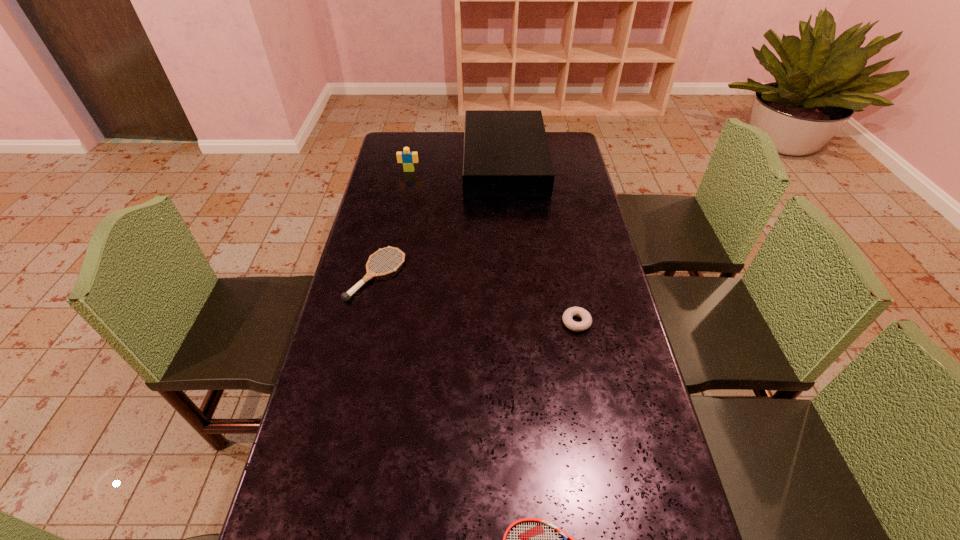
Find the location of a particular element. The image size is (960, 540). vacant space located on the left of the doughnut is located at coordinates (488, 322).

Locate an element on the screen. The width and height of the screenshot is (960, 540). object at the far edge is located at coordinates (506, 154).

At what (x,y) coordinates should I click in order to perform the action: click on Lego at the left edge. Please return your answer as a coordinate pair (x, y). Looking at the image, I should click on (408, 158).

This screenshot has height=540, width=960. Find the location of `tennis racket positioned at the left edge`. tennis racket positioned at the left edge is located at coordinates pos(346,296).

You are a GUI agent. You are given a task and a screenshot of the screen. Output one action in this format:
    pyautogui.click(x=<x>, y=<y>)
    Task: Click on the CD player at the right edge
    
    Given the screenshot: What is the action you would take?
    pyautogui.click(x=506, y=154)

Where is `doughnut located at the right edge`? doughnut located at the right edge is located at coordinates (586, 322).

Where is `object that is at the far right corner`? The image size is (960, 540). object that is at the far right corner is located at coordinates (506, 154).

Where is `vacant space at the far edge of the desktop`? The image size is (960, 540). vacant space at the far edge of the desktop is located at coordinates (448, 142).

What are the coordinates of `blank space at the left edge of the desktop` in the screenshot? It's located at (296, 520).

Image resolution: width=960 pixels, height=540 pixels. I want to click on free point at the far right corner, so click(562, 145).